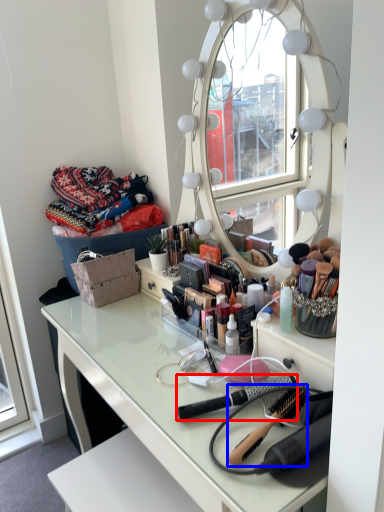
Question: Which object appears farthest to the camera in this image, brush (highlighted by a red box) or brush (highlighted by a blue box)?

Choices:
 (A) brush
 (B) brush

Answer: (A)